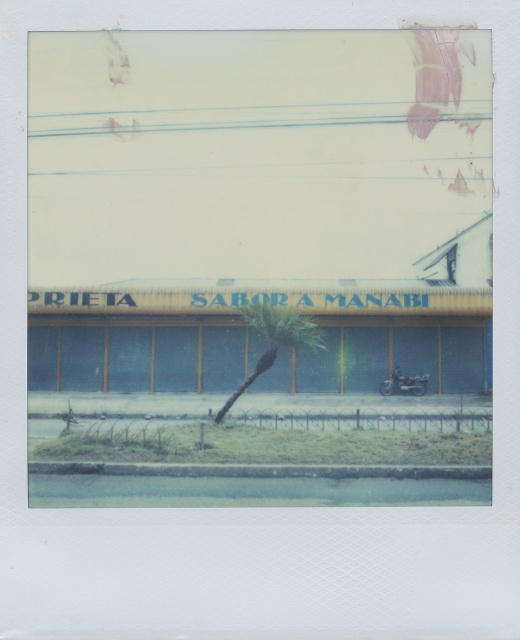
You are a pedestrian standing on the sidewalk in front of the building. You want to walk to the shiny black motorcycle at center. Is the green leafy tree at center blocking your path?

The green leafy tree at center is in front of the shiny black motorcycle at center, so the tree is blocking the path to the motorcycle.

You are standing at the point with coordinates point (267, 353) and want to walk towards the point with coordinates point (411, 387) in the image. Will you pass in front of or behind the building with the sign PRIETA SABOR A MANABI?

Point (267, 353) is in front of point (411, 387), so walking from point (267, 353) towards point (411, 387) would mean moving away from the building, so you would pass behind the building with the sign PRIETA SABOR A MANABI.